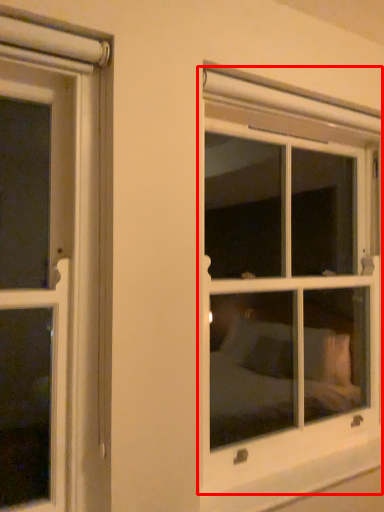
Question: From the image, what is the correct spatial relationship of window (annotated by the red box) in relation to window sill?

Choices:
 (A) right
 (B) left

Answer: (B)